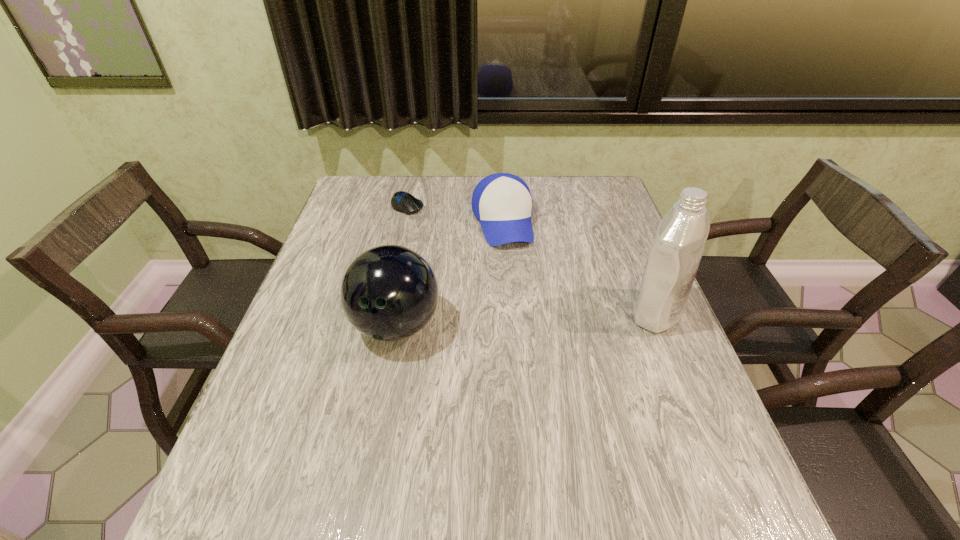
Image resolution: width=960 pixels, height=540 pixels. Identify the location of free space between the shortest object and the tallest object. (532, 259).

Where is `free space between the rightmost object and the third object from left to right`? This screenshot has width=960, height=540. free space between the rightmost object and the third object from left to right is located at coordinates (579, 267).

This screenshot has width=960, height=540. What are the coordinates of `free point between the baseball cap and the computer mouse` in the screenshot? It's located at (455, 213).

Locate an element on the screen. vacant point located between the bowling ball and the baseball cap is located at coordinates (449, 273).

I want to click on free space that is in between the second object from right to left and the third shortest object, so click(x=449, y=273).

Select which object appears as the closest to the baseball cap. Please provide its 2D coordinates. Your answer should be formatted as a tuple, i.e. [(x, y)], where the tuple contains the x and y coordinates of a point satisfying the conditions above.

[(404, 202)]

Image resolution: width=960 pixels, height=540 pixels. In order to click on object that is the third closest to the bowling ball in this screenshot , I will do `click(673, 261)`.

Where is `vacant space that satisfies the following two spatial constraints: 1. on the front side of the computer mouse; 2. on the left side of the baseball cap`? The image size is (960, 540). vacant space that satisfies the following two spatial constraints: 1. on the front side of the computer mouse; 2. on the left side of the baseball cap is located at coordinates (403, 222).

The height and width of the screenshot is (540, 960). In order to click on vacant space that satisfies the following two spatial constraints: 1. on the front side of the computer mouse; 2. on the right side of the tallest object in this screenshot , I will do `click(383, 313)`.

Where is `vacant position in the image that satisfies the following two spatial constraints: 1. on the front side of the detergent; 2. on the left side of the baseball cap`? The height and width of the screenshot is (540, 960). vacant position in the image that satisfies the following two spatial constraints: 1. on the front side of the detergent; 2. on the left side of the baseball cap is located at coordinates (508, 313).